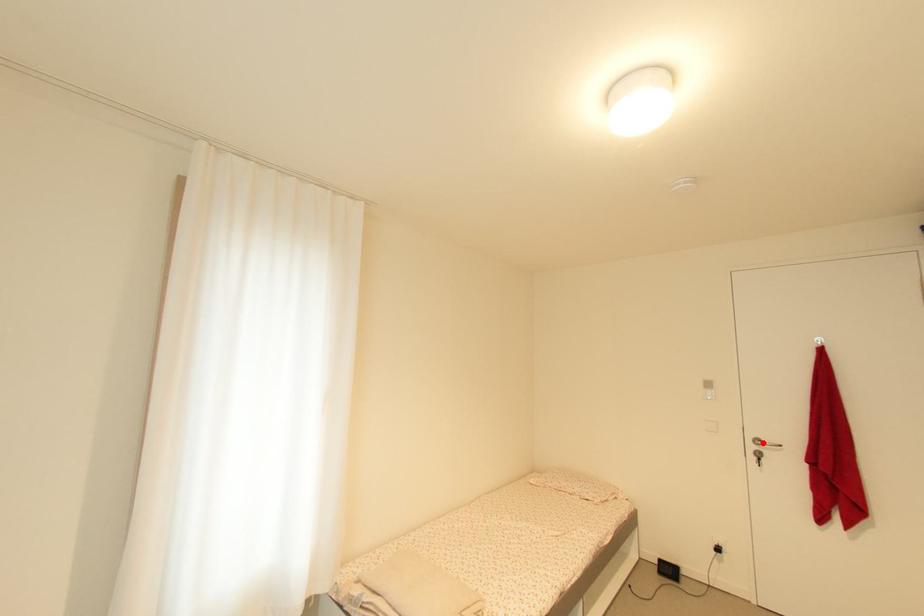
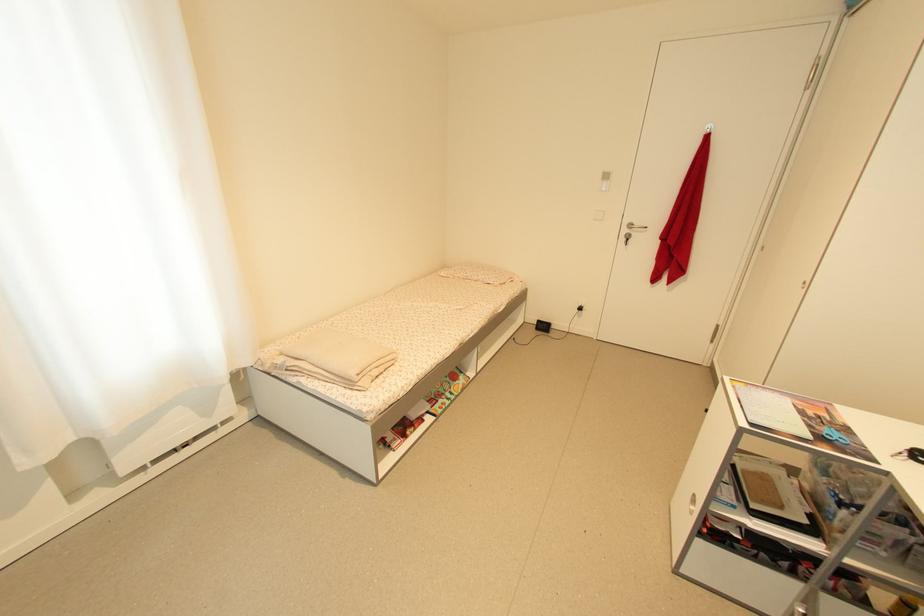
Find the pixel in the second image that matches the highlighted location in the first image.

(636, 227)